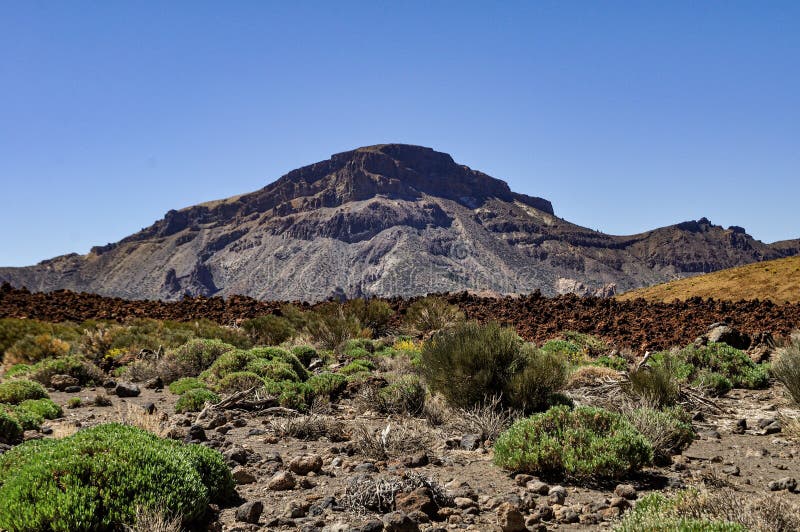
You are a GUI agent. You are given a task and a screenshot of the screen. Output one action in this format:
    pyautogui.click(x=<x>, y=<y>)
    Task: Click on the olive green plant
    This screenshot has width=800, height=532.
    Given the screenshot: What is the action you would take?
    pyautogui.click(x=474, y=365)